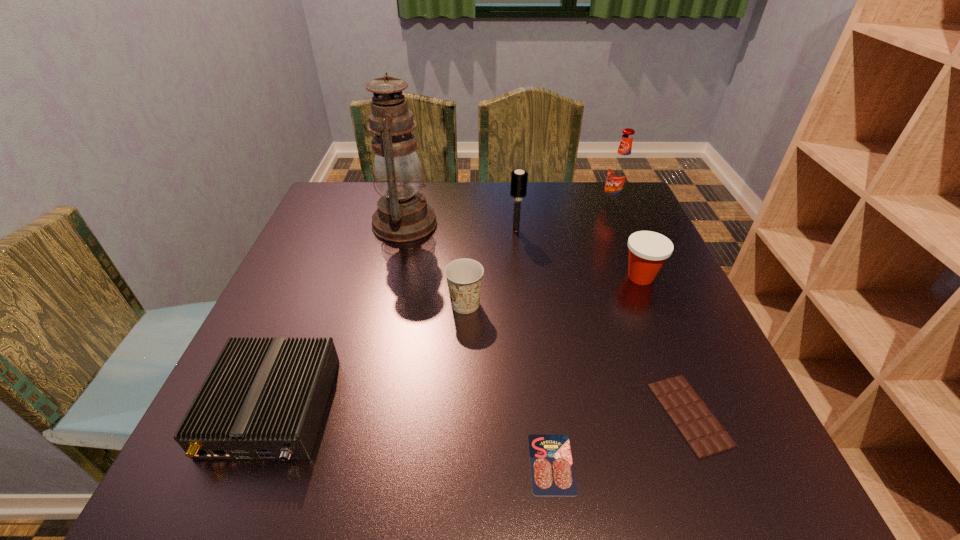
The image size is (960, 540). What are the coordinates of `free space located on the left of the oil lamp` in the screenshot? It's located at (346, 224).

At what (x,y) coordinates should I click in order to perform the action: click on free spot located on the left of the second tallest object. Please return your answer as a coordinate pair (x, y). The height and width of the screenshot is (540, 960). Looking at the image, I should click on (482, 205).

I want to click on vacant space located on the right of the hairbrush, so click(x=642, y=230).

This screenshot has width=960, height=540. What are the coordinates of `vacant space located 0.150m on the back of the farther Dixie cup` in the screenshot? It's located at (620, 228).

Find the location of a particular element. This screenshot has width=960, height=540. free space located 0.110m on the front of the left Dixie cup is located at coordinates (464, 360).

The width and height of the screenshot is (960, 540). Find the location of `free spot located on the back of the second shortest object`. free spot located on the back of the second shortest object is located at coordinates (665, 354).

Where is `vacant area situated 0.080m on the back of the shortest object`? vacant area situated 0.080m on the back of the shortest object is located at coordinates (542, 393).

Where is `oil lamp at the far edge`? The width and height of the screenshot is (960, 540). oil lamp at the far edge is located at coordinates (403, 215).

Identify the location of root beer that is at the far edge. (619, 173).

Identify the location of hairbrush situated at the far edge. (519, 178).